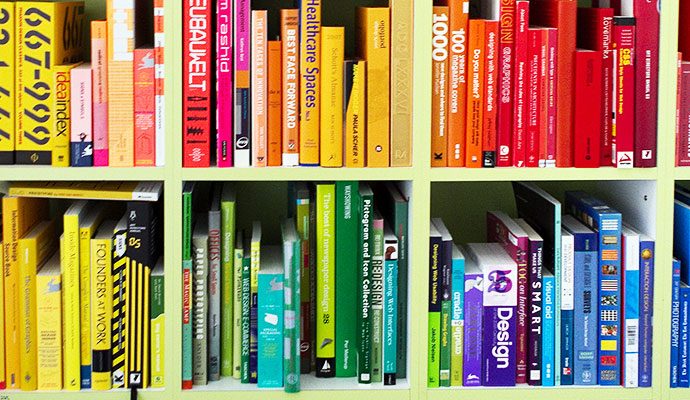
Locate an element on the screen. shelves is located at coordinates (104, 394), (257, 390), (464, 392), (680, 174), (682, 394), (493, 176), (239, 177), (110, 171).